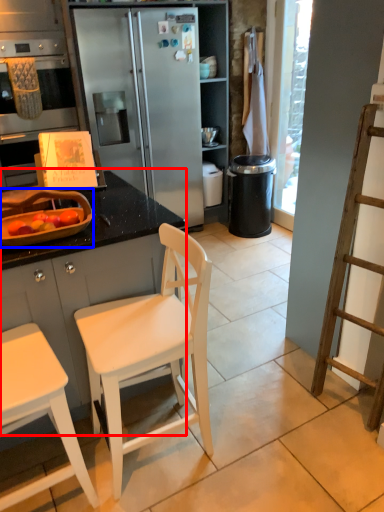
Question: Which object appears farthest to the camera in this image, cabinetry (highlighted by a red box) or appliance (highlighted by a blue box)?

Choices:
 (A) cabinetry
 (B) appliance

Answer: (B)